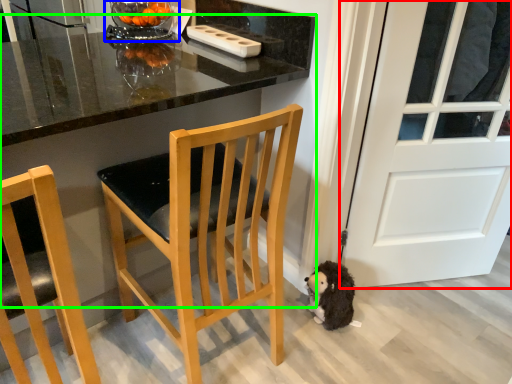
Question: Which is farther away from door (highlighted by a red box)? glass bowl (highlighted by a blue box) or table (highlighted by a green box)?

Choices:
 (A) glass bowl
 (B) table

Answer: (A)